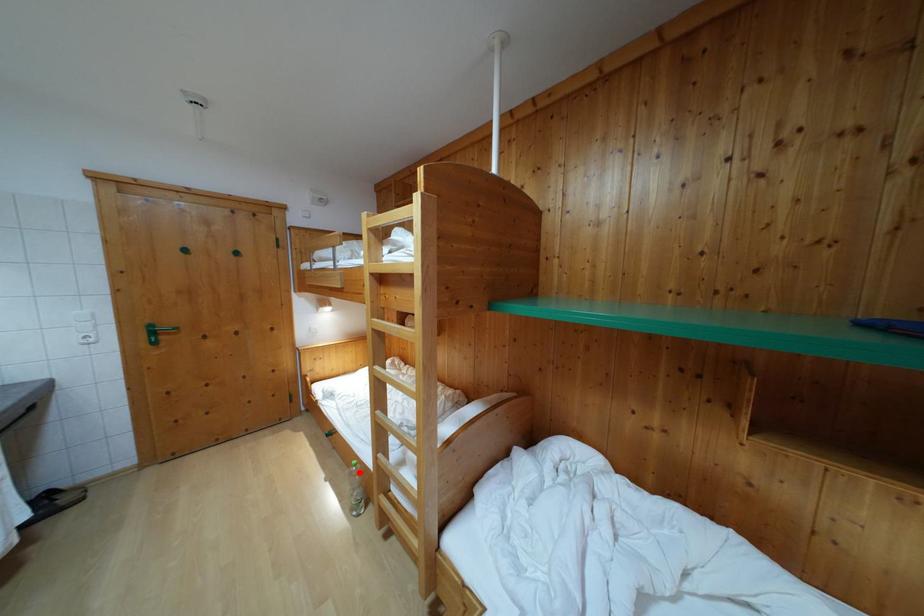
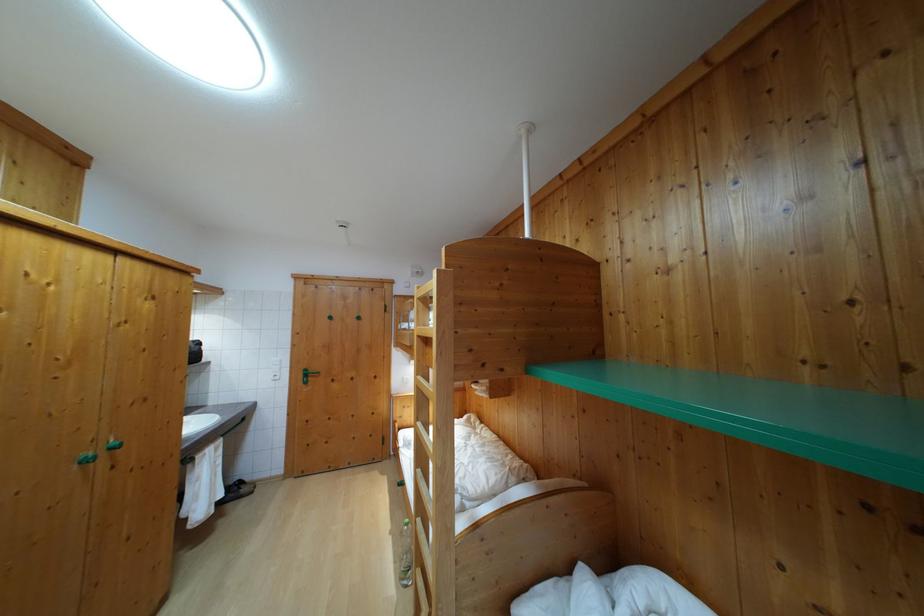
In the second image, find the point that corresponds to the highlighted location in the first image.

(410, 532)